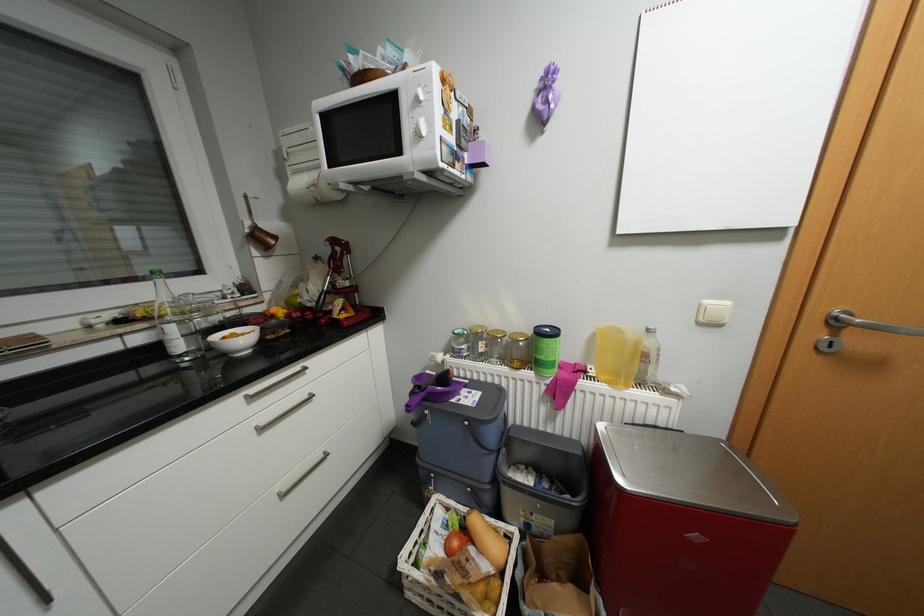
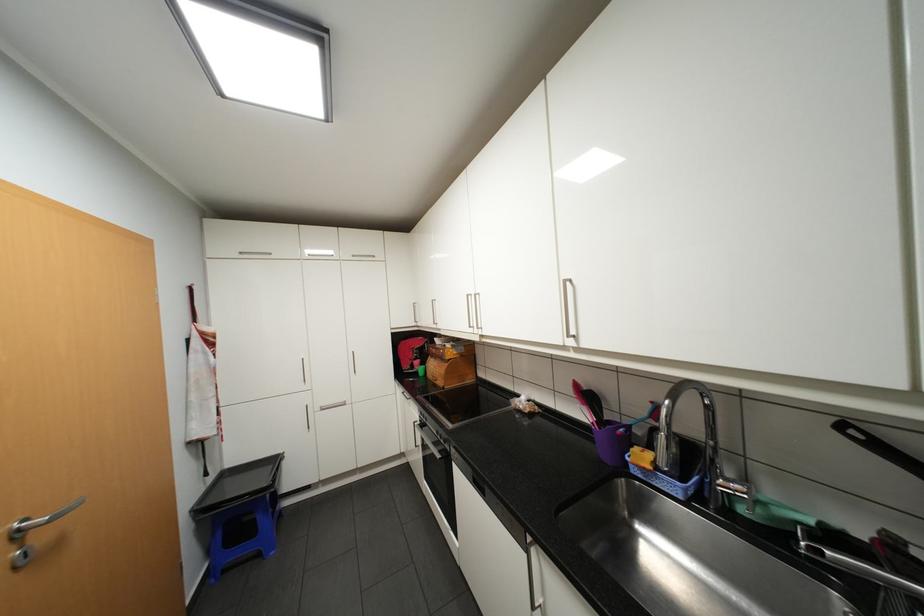
Where in the second image is the point corresponding to [844,318] from the first image?

(27, 530)